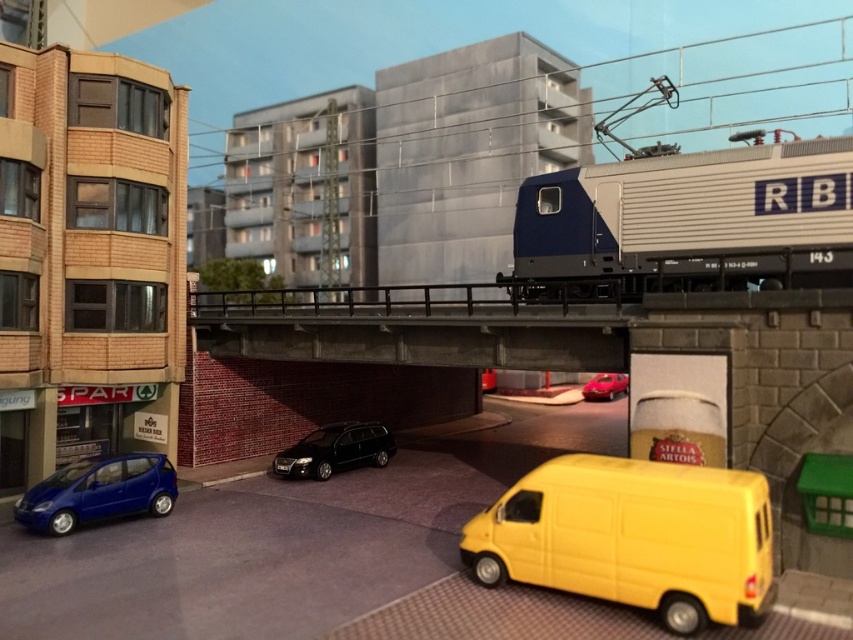
Question: Considering the relative positions of concrete bridge at center and shiny red car at center in the image provided, where is concrete bridge at center located with respect to shiny red car at center?

Choices:
 (A) above
 (B) below

Answer: (A)

Question: Is smooth concrete parking garage at center bigger than shiny black sedan at center?

Choices:
 (A) yes
 (B) no

Answer: (A)

Question: Which point appears closest to the camera in this image?

Choices:
 (A) (352, 444)
 (B) (602, 372)
 (C) (582, 227)
 (D) (677, 516)

Answer: (D)

Question: Among these objects, which one is farthest from the camera?

Choices:
 (A) smooth concrete parking garage at center
 (B) concrete bridge at center
 (C) yellow matte van at lower right
 (D) metallic blue hatchback at lower left

Answer: (A)

Question: Which point appears farthest from the camera in this image?

Choices:
 (A) (62, 476)
 (B) (347, 164)
 (C) (743, 566)
 (D) (589, 380)

Answer: (B)

Question: Does yellow matte van at lower right appear over metallic blue hatchback at lower left?

Choices:
 (A) yes
 (B) no

Answer: (A)